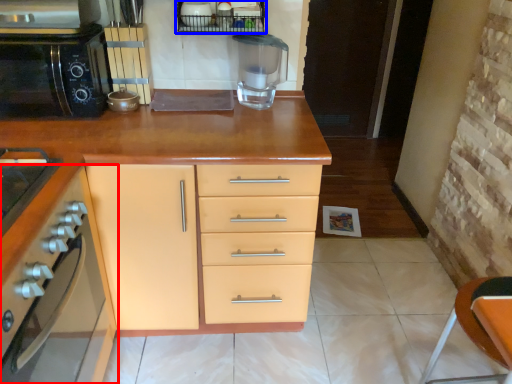
Question: Among these objects, which one is farthest to the camera, cabinetry (highlighted by a red box) or shelf (highlighted by a blue box)?

Choices:
 (A) cabinetry
 (B) shelf

Answer: (B)